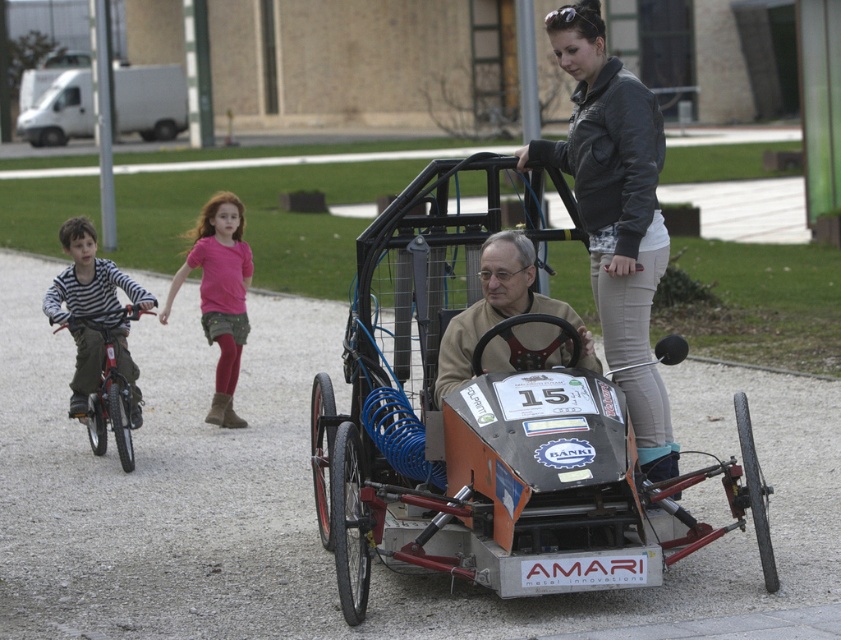
Question: Which is nearer to the orange metallic tricycle at center?

Choices:
 (A) white matte van at upper left
 (B) leather jacket at center

Answer: (B)

Question: Which point appears farthest from the camera in this image?

Choices:
 (A) (487, 269)
 (B) (85, 296)
 (C) (662, 140)

Answer: (B)

Question: Considering the real-world distances, which object is farthest from the pink fabric skirt at center?

Choices:
 (A) metallic silver bicycle at left
 (B) leather jacket at center
 (C) matte beige shirt at center
 (D) orange metallic tricycle at center

Answer: (B)

Question: Does leather jacket at center lie behind striped fabric shirt at left?

Choices:
 (A) no
 (B) yes

Answer: (A)

Question: Is matte beige shirt at center above pink fabric skirt at center?

Choices:
 (A) yes
 (B) no

Answer: (B)

Question: Is orange metallic tricycle at center positioned at the back of matte beige shirt at center?

Choices:
 (A) yes
 (B) no

Answer: (B)